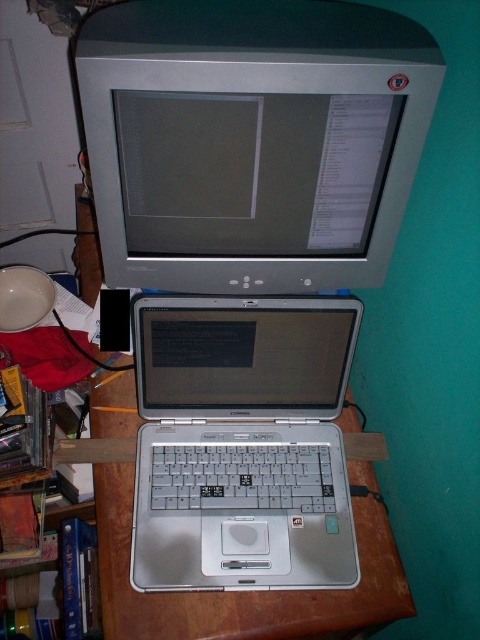
You are setting up a new monitor on your desk. You have a silver metallic laptop at center and a satin silver monitor at upper center. Where should you place the new monitor to avoid blocking the laptop?

The satin silver monitor at upper center is already positioned on the right side of the silver metallic laptop at center, so placing the new monitor to the left of the laptop would prevent blocking it.

You are setting up a new monitor stand that requires knowing the vertical distance between the satin silver monitor at upper center and the silver metallic laptop at center. According to the scene description, can you determine if the monitor is placed above the laptop?

Yes, the satin silver monitor at upper center is placed above the silver metallic laptop at center as stated in the scene description.

You are standing in front of the workspace setup described. There are two points marked on the desk. The first point is at coordinates point [112,13] and the second is at point [188,340]. If you were to reach out to touch both points, which point would require you to stretch your arm further away from your body?

Point [188,340] would require stretching further because it is farther from the viewer compared to point [112,13].